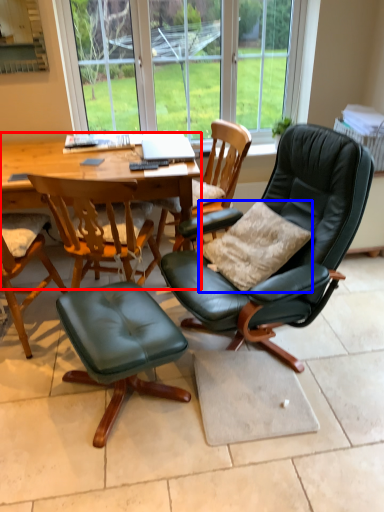
Question: Which object is closer to the camera taking this photo, round table (highlighted by a red box) or pillow (highlighted by a blue box)?

Choices:
 (A) round table
 (B) pillow

Answer: (B)